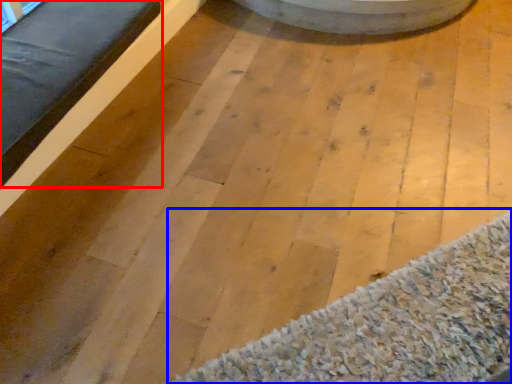
Question: Which of the following is the closest to the observer, furniture (highlighted by a red box) or mat (highlighted by a blue box)?

Choices:
 (A) furniture
 (B) mat

Answer: (B)